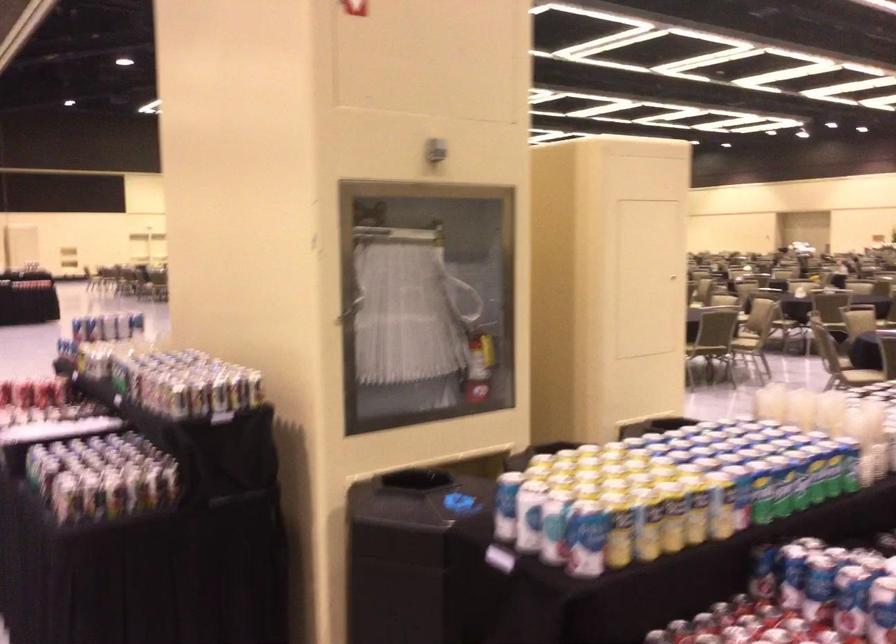
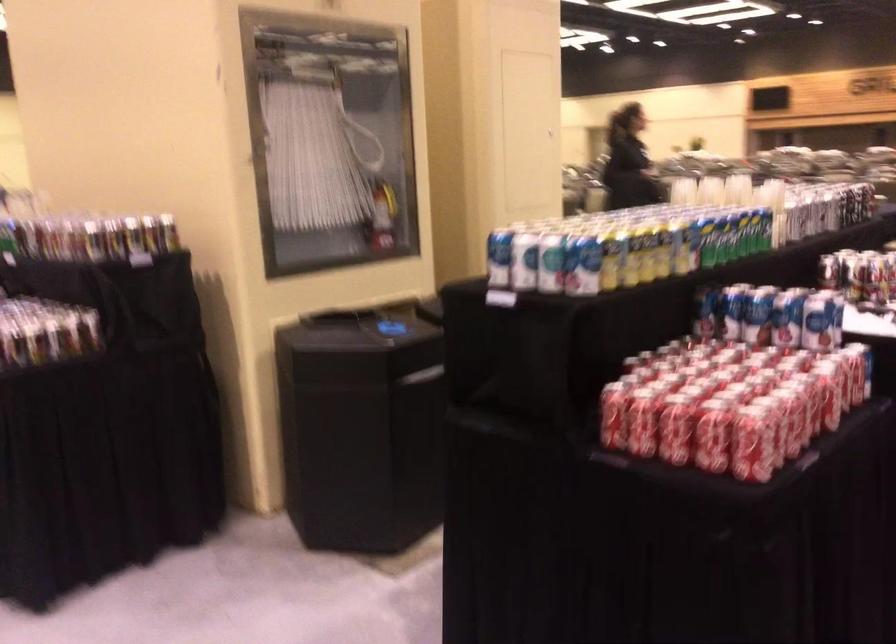
Locate, in the second image, the point that corresponds to point (780, 494) in the first image.

(722, 238)